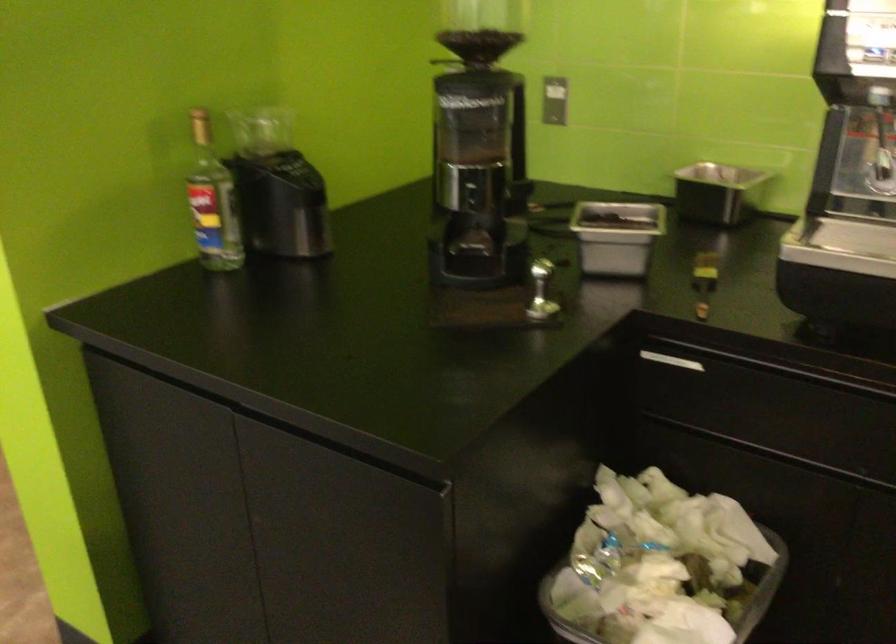
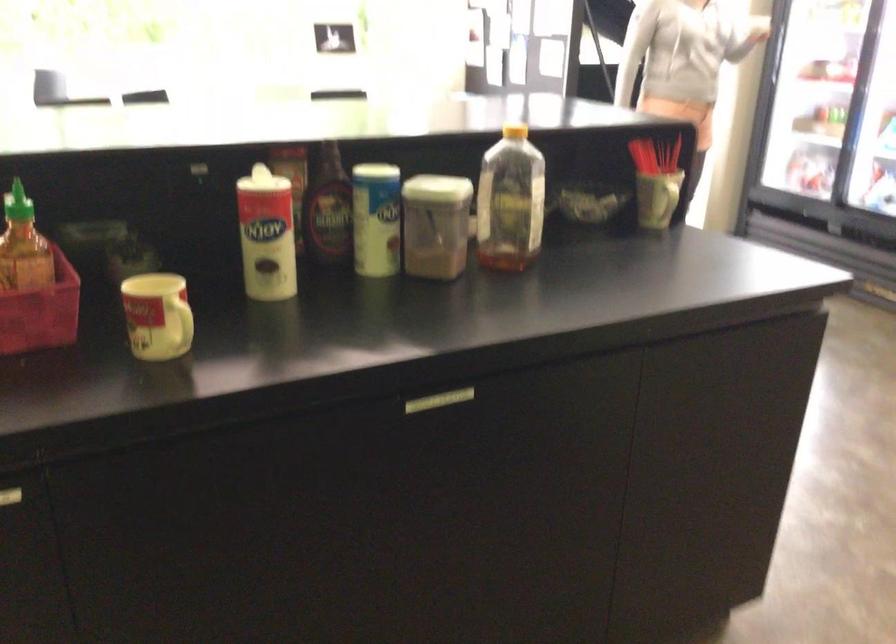
Based on the photo, based on the continuous images, in which direction is the camera rotating?

The camera rotated toward left-down.